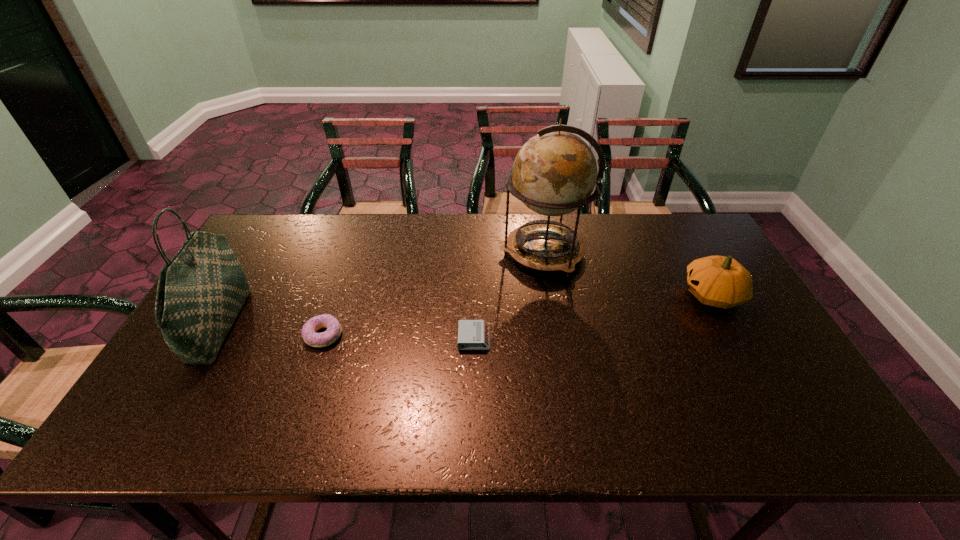
The image size is (960, 540). I want to click on object located in the left edge section of the desktop, so click(x=201, y=290).

The width and height of the screenshot is (960, 540). Find the location of `object at the right edge`. object at the right edge is located at coordinates (719, 281).

This screenshot has height=540, width=960. Identify the location of vacant area at the far edge of the desktop. (403, 217).

Find the location of a particular element. blank space at the near edge of the desktop is located at coordinates (602, 414).

The image size is (960, 540). In the image, there is a desktop. Find the location of `vacant space at the left edge`. vacant space at the left edge is located at coordinates (249, 278).

The height and width of the screenshot is (540, 960). Identify the location of free space at the far left corner. (289, 236).

What are the coordinates of `free space at the near right corner` in the screenshot? It's located at (827, 420).

I want to click on vacant area between the tote bag and the shortest object, so click(348, 331).

At what (x,y) coordinates should I click in order to perform the action: click on blank region between the tallest object and the third object from right to left. Please return your answer as a coordinate pair (x, y). The height and width of the screenshot is (540, 960). Looking at the image, I should click on (509, 295).

The height and width of the screenshot is (540, 960). Find the location of `vacant area that lies between the second object from right to left and the tote bag`. vacant area that lies between the second object from right to left and the tote bag is located at coordinates tap(382, 288).